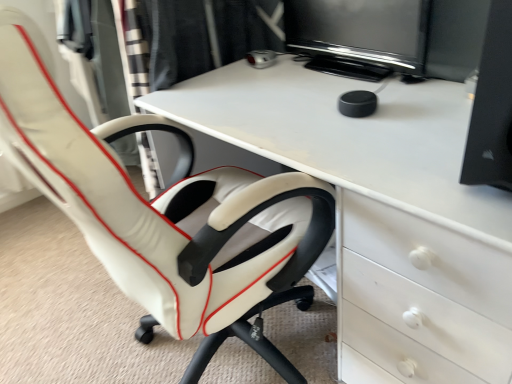
Locate an element on the screen. free space above white glossy desk at center (from a real-world perspective) is located at coordinates (328, 104).